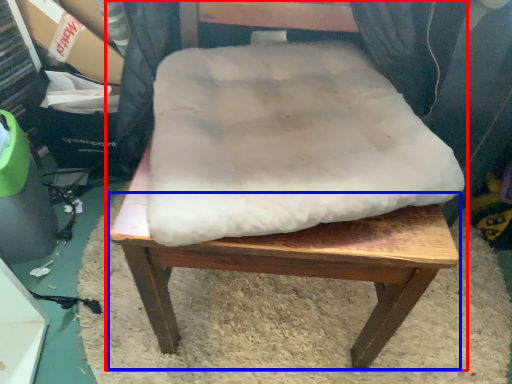
Question: Which point is further to the camera, chair (highlighted by a red box) or step stool (highlighted by a blue box)?

Choices:
 (A) chair
 (B) step stool

Answer: (B)